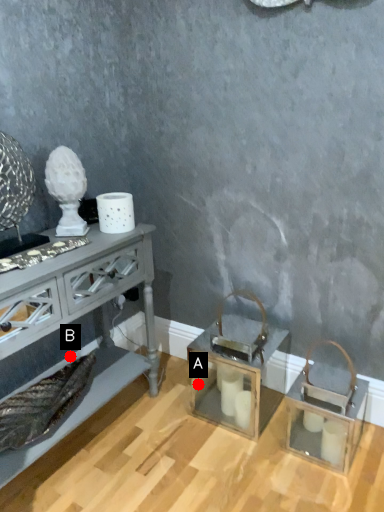
Question: Two points are circled on the image, labeled by A and B beside each circle. Which point is further to the camera?

Choices:
 (A) A is further
 (B) B is further

Answer: (A)